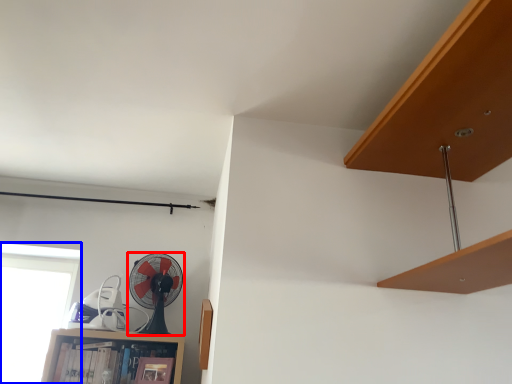
Question: Which point is further to the camera, mechanical fan (highlighted by a red box) or window (highlighted by a blue box)?

Choices:
 (A) mechanical fan
 (B) window

Answer: (B)